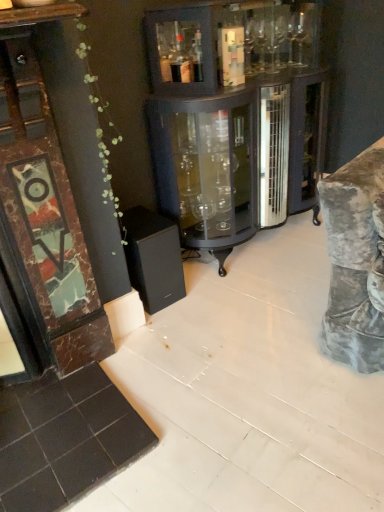
You are a GUI agent. You are given a task and a screenshot of the screen. Output one action in this format:
    pyautogui.click(x=<x>, y=<y>)
    Task: Click on the vacant area in front of black matte speaker at lower left
    Image resolution: width=384 pixels, height=512 pixels.
    Given the screenshot: What is the action you would take?
    pyautogui.click(x=169, y=329)